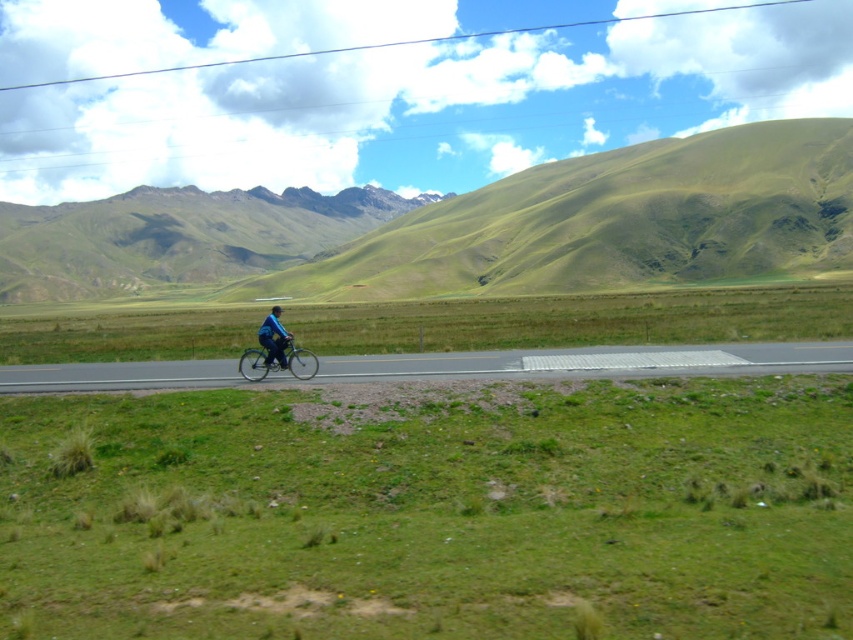
Does green grassy mountain at upper center appear on the right side of black matte helmet at center?

In fact, green grassy mountain at upper center is to the left of black matte helmet at center.

Which is in front, point (236, 257) or point (280, 314)?

Positioned in front is point (280, 314).

What do you see at coordinates (177, 236) in the screenshot? I see `green grassy mountain at upper center` at bounding box center [177, 236].

The image size is (853, 640). In order to click on green grassy mountain at upper center in this screenshot , I will do `click(177, 236)`.

Is point (785, 243) farther from camera compared to point (311, 356)?

That is True.

Can you confirm if green grassy hill at upper center is taller than blue matte bicycle at center?

Indeed, green grassy hill at upper center has a greater height compared to blue matte bicycle at center.

Where is `green grassy hill at upper center`? green grassy hill at upper center is located at coordinates (610, 221).

Locate an element on the screen. Image resolution: width=853 pixels, height=640 pixels. green grassy hill at upper center is located at coordinates (610, 221).

Is green grassy hill at upper center thinner than blue fabric jacket at center?

No, green grassy hill at upper center is not thinner than blue fabric jacket at center.

Is green grassy hill at upper center further to camera compared to blue fabric jacket at center?

Yes, green grassy hill at upper center is behind blue fabric jacket at center.

Image resolution: width=853 pixels, height=640 pixels. I want to click on green grassy hill at upper center, so click(x=610, y=221).